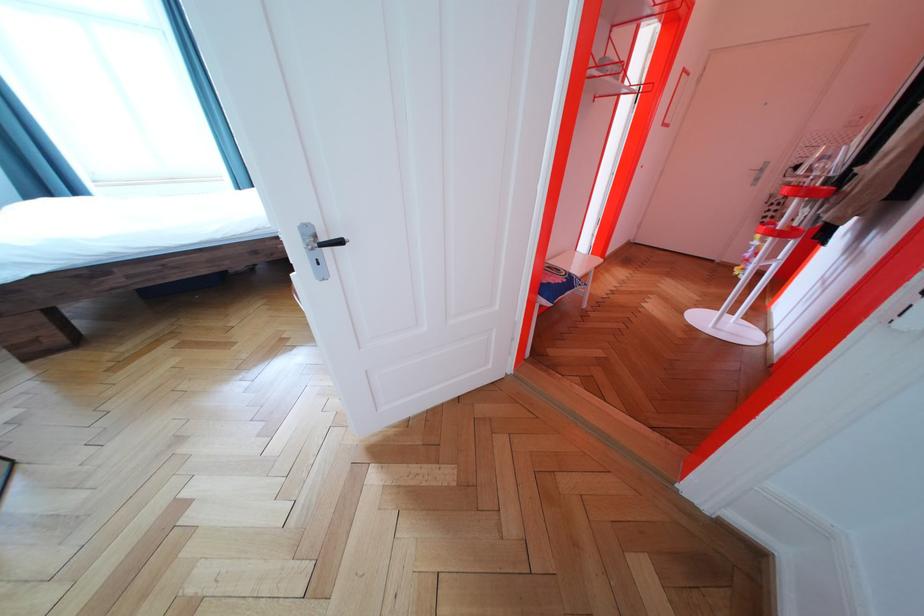
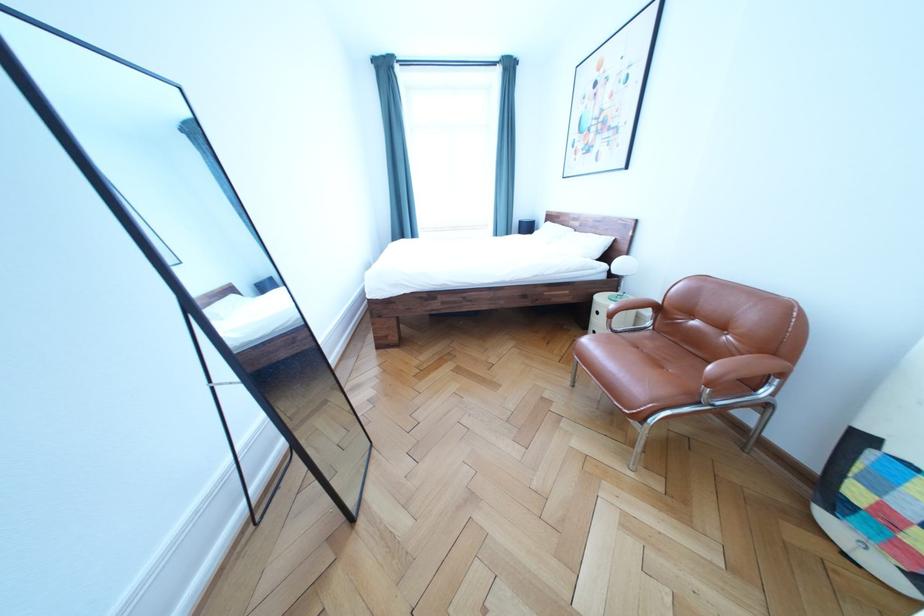
Question: The first image is from the beginning of the video and the second image is from the end. How did the camera likely rotate when shooting the video?

Choices:
 (A) Left
 (B) Right
 (C) Up
 (D) Down

Answer: (A)